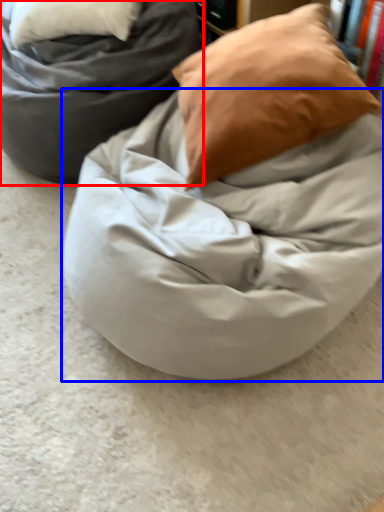
Question: Which object appears closest to the camera in this image, furniture (highlighted by a red box) or blanket (highlighted by a blue box)?

Choices:
 (A) furniture
 (B) blanket

Answer: (B)